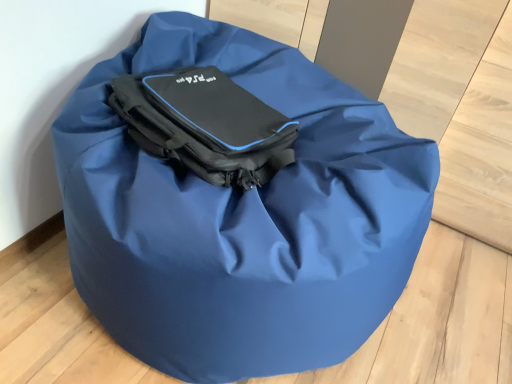
Question: Is there a large distance between matte black bag at center and matte blue bag at center?

Choices:
 (A) no
 (B) yes

Answer: (A)

Question: Is matte black bag at center closer to camera compared to matte blue bag at center?

Choices:
 (A) no
 (B) yes

Answer: (A)

Question: Is matte black bag at center taller than matte blue bag at center?

Choices:
 (A) no
 (B) yes

Answer: (A)

Question: From a real-world perspective, does matte black bag at center stand above matte blue bag at center?

Choices:
 (A) no
 (B) yes

Answer: (B)

Question: Is matte black bag at center to the left of matte blue bag at center from the viewer's perspective?

Choices:
 (A) yes
 (B) no

Answer: (A)

Question: Does matte black bag at center come behind matte blue bag at center?

Choices:
 (A) yes
 (B) no

Answer: (A)

Question: Considering the relative sizes of matte blue bag at center and matte black bag at center in the image provided, is matte blue bag at center smaller than matte black bag at center?

Choices:
 (A) no
 (B) yes

Answer: (A)

Question: Is matte blue bag at center oriented away from matte black bag at center?

Choices:
 (A) no
 (B) yes

Answer: (A)

Question: Considering the relative sizes of matte blue bag at center and matte black bag at center in the image provided, is matte blue bag at center taller than matte black bag at center?

Choices:
 (A) no
 (B) yes

Answer: (B)

Question: Is matte blue bag at center at the right side of matte black bag at center?

Choices:
 (A) no
 (B) yes

Answer: (B)

Question: From a real-world perspective, is matte blue bag at center over matte black bag at center?

Choices:
 (A) yes
 (B) no

Answer: (B)

Question: From a real-world perspective, does matte blue bag at center sit lower than matte black bag at center?

Choices:
 (A) no
 (B) yes

Answer: (B)

Question: Is matte black bag at center situated inside matte blue bag at center or outside?

Choices:
 (A) outside
 (B) inside

Answer: (B)